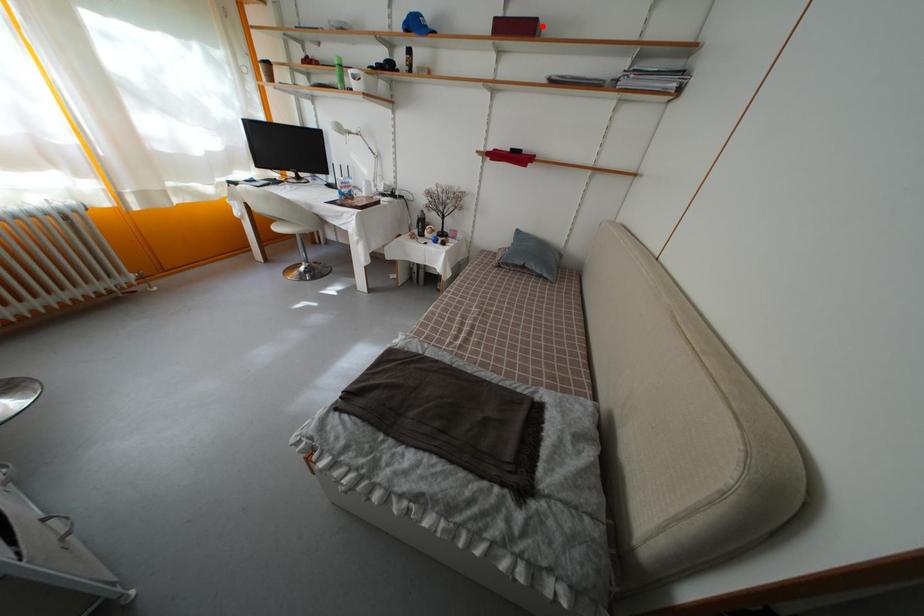
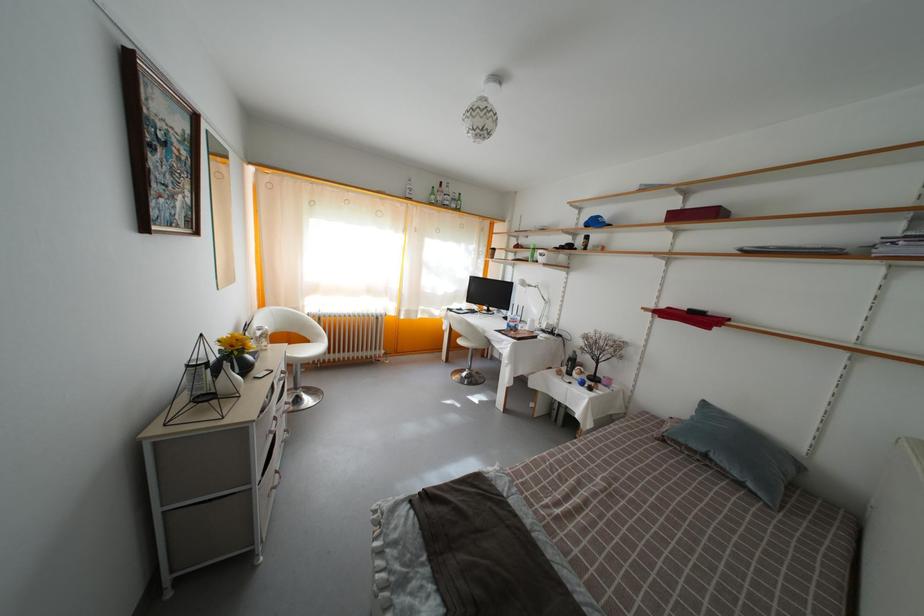
The point at the highlighted location is marked in the first image. Where is the corresponding point in the second image?

(724, 214)